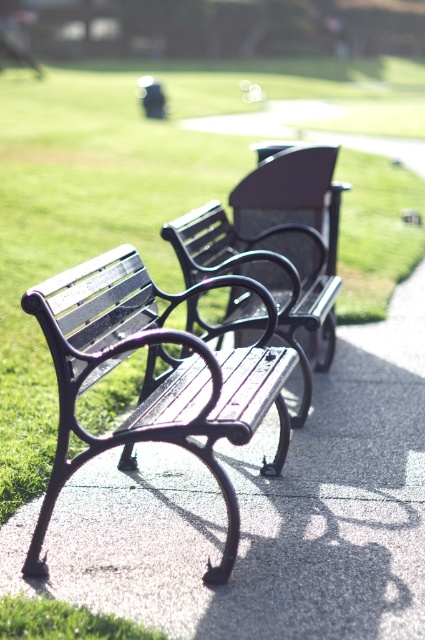
Who is shorter, green grass at center or wooden bench at center?

With less height is wooden bench at center.

Can you confirm if green grass at center is positioned to the right of wooden bench at center?

No, green grass at center is not to the right of wooden bench at center.

Between point (93, 124) and point (291, 168), which one is positioned in front?

Positioned in front is point (291, 168).

This screenshot has width=425, height=640. In order to click on green grass at center in this screenshot , I will do pyautogui.click(x=82, y=224).

Does green grass at center have a lesser height compared to matte black bench at center?

No, green grass at center is not shorter than matte black bench at center.

Which is more to the right, green grass at center or matte black bench at center?

matte black bench at center

Describe the element at coordinates (82, 224) in the screenshot. I see `green grass at center` at that location.

Find the location of a particular element. The width and height of the screenshot is (425, 640). green grass at center is located at coordinates pyautogui.click(x=82, y=224).

Who is positioned more to the right, matte black bench at center or wooden bench at center?

From the viewer's perspective, wooden bench at center appears more on the right side.

Image resolution: width=425 pixels, height=640 pixels. Describe the element at coordinates (153, 378) in the screenshot. I see `matte black bench at center` at that location.

Find the location of a particular element. The image size is (425, 640). matte black bench at center is located at coordinates (153, 378).